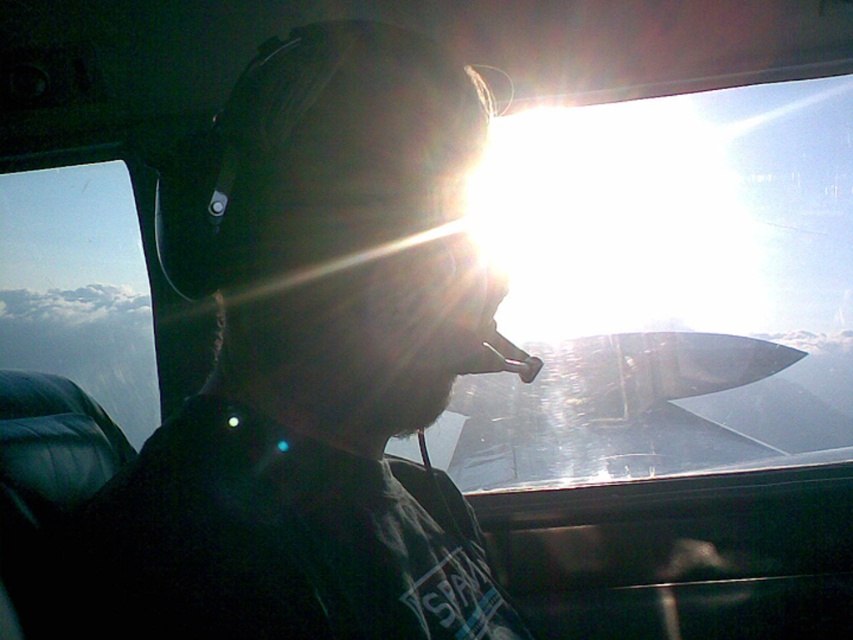
Question: Can you confirm if black matte helmet at center is smaller than transparent glass airplane window at upper center?

Choices:
 (A) yes
 (B) no

Answer: (A)

Question: Is black matte helmet at center below transparent glass airplane window at upper center?

Choices:
 (A) yes
 (B) no

Answer: (A)

Question: Which of the following is the closest to the observer?

Choices:
 (A) transparent glass airplane window at upper center
 (B) black matte helmet at center

Answer: (B)

Question: Is black matte helmet at center positioned behind transparent glass airplane window at upper center?

Choices:
 (A) yes
 (B) no

Answer: (B)